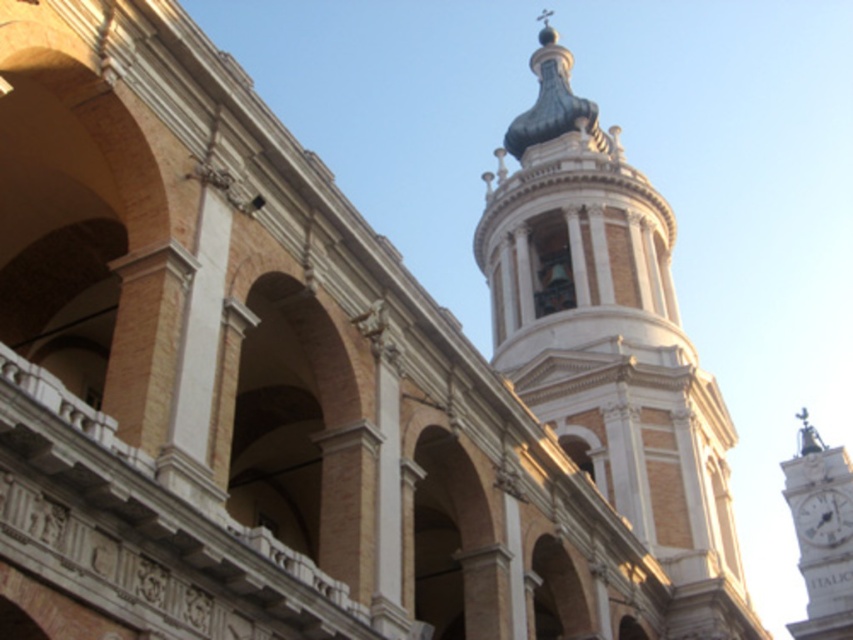
You are an architect examining the grand structure. You notice the white marble bell tower at upper center and the white marble clock tower at right. Which of these two towers has a greater height?

The white marble bell tower at upper center is taller than the white marble clock tower at right.

You are an architect examining the structure and need to determine the spatial relationship between the white marble bell tower at upper center and the white glossy clock at upper right. Which object is positioned higher in the image?

The white marble bell tower at upper center is positioned higher than the white glossy clock at upper right.